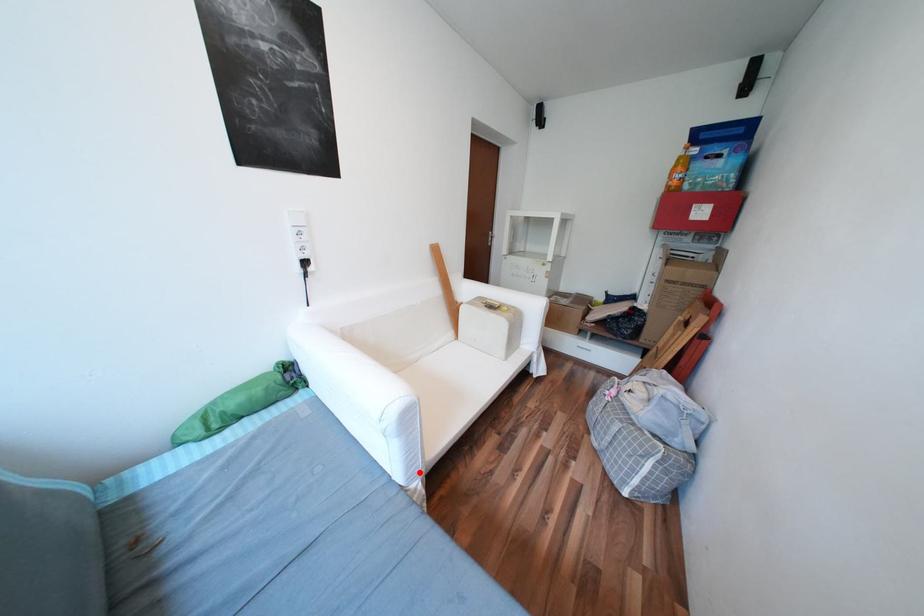
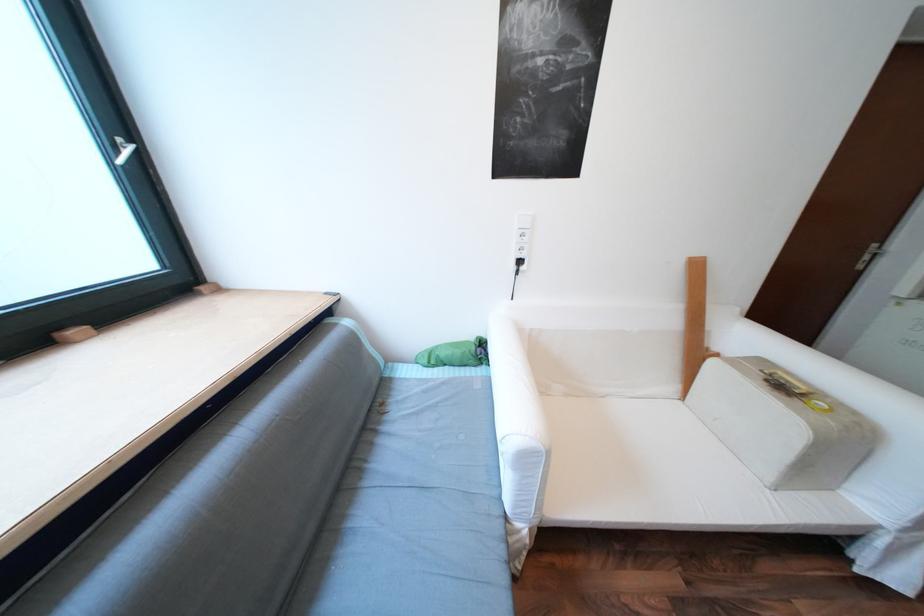
In the second image, find the point that corresponds to the highlighted location in the first image.

(528, 511)